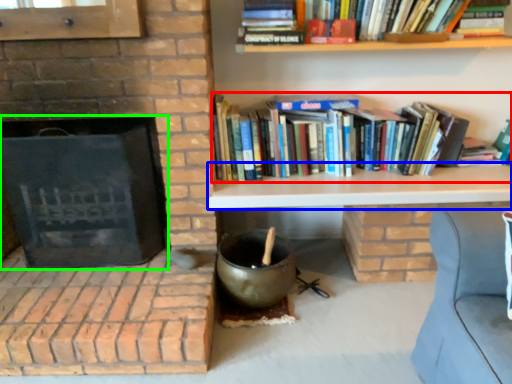
Question: Which object is positioned farthest from book (highlighted by a red box)? Select from table (highlighted by a blue box) and fireplace (highlighted by a green box).

Choices:
 (A) table
 (B) fireplace

Answer: (B)